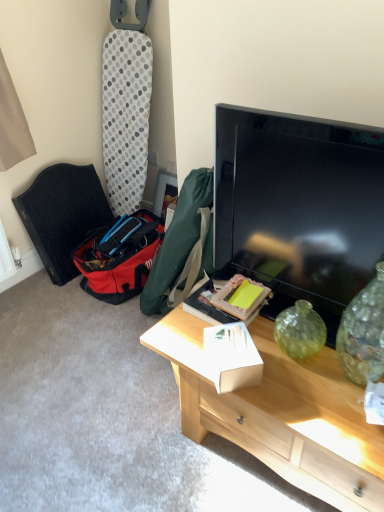
Where is `empty space that is ontop of white cardboard box at center, acting as the second box starting from the front`? This screenshot has height=512, width=384. empty space that is ontop of white cardboard box at center, acting as the second box starting from the front is located at coordinates (228, 302).